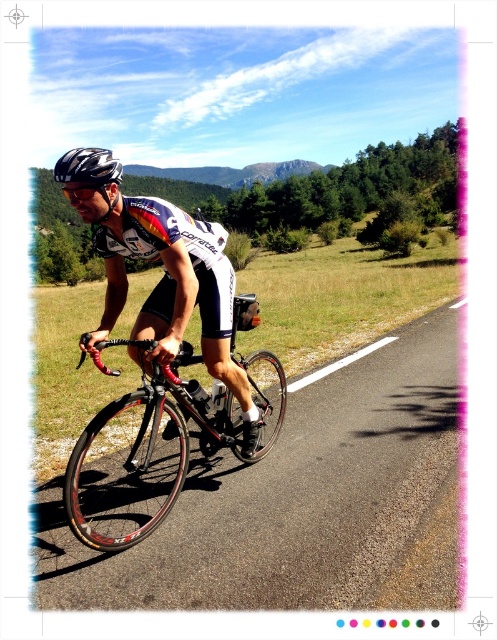
Question: Among these points, which one is nearest to the camera?

Choices:
 (A) (110, 177)
 (B) (159, 221)

Answer: (A)

Question: Can you confirm if matte black bicycle at center is positioned to the right of black matte bicycle helmet at upper left?

Choices:
 (A) no
 (B) yes

Answer: (B)

Question: Does matte black bicycle at center appear on the right side of black matte bicycle helmet at upper left?

Choices:
 (A) yes
 (B) no

Answer: (A)

Question: Is matte black bicycle at center bigger than shiny black frame at center?

Choices:
 (A) yes
 (B) no

Answer: (A)

Question: Which of the following is the closest to the observer?

Choices:
 (A) (243, 371)
 (B) (119, 166)

Answer: (B)

Question: Estimate the real-world distances between objects in this image. Which object is farther from the shiny black frame at center?

Choices:
 (A) matte black bicycle at center
 (B) black matte bicycle helmet at upper left

Answer: (B)